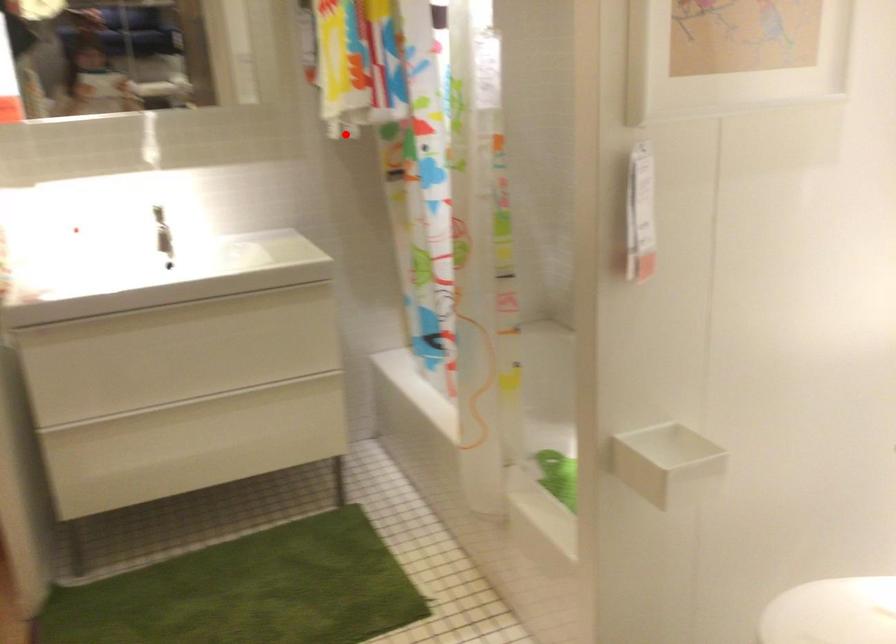
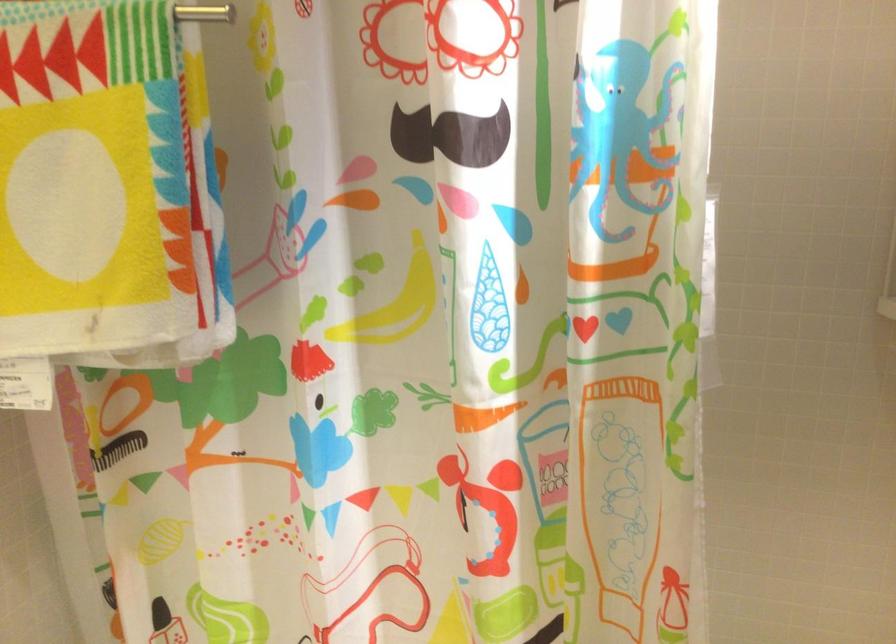
Find the pixel in the second image that matches the highlighted location in the first image.

(26, 384)